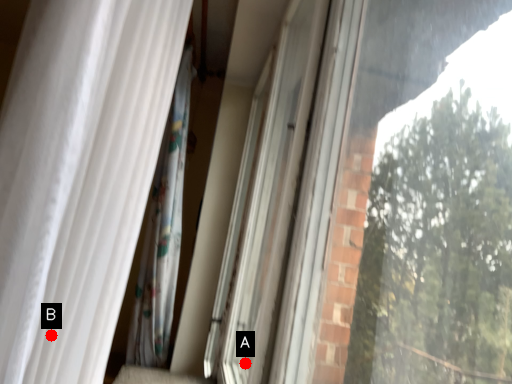
Question: Two points are circled on the image, labeled by A and B beside each circle. Among these points, which one is nearest to the camera?

Choices:
 (A) A is closer
 (B) B is closer

Answer: (B)